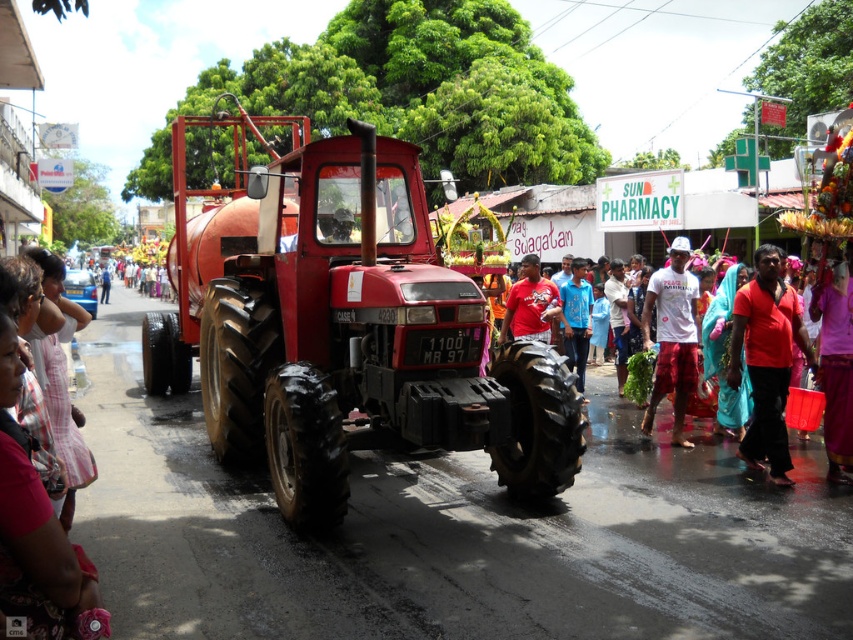
You are standing in the middle of the street during the festival and see two points marked in the scene. The first point is at coordinate point (740, 448) and the second is at point (772, 467). Which point is closer to you?

Point (740, 448) is closer to you because it is further to the viewer than point (772, 467).

You are standing at the point labeled as point (766, 362) in the image. Looking around, you see a large red tractor at the center and a red fabric cloth at center. Which object is directly in front of you?

The point (766, 362) corresponds to the red fabric cloth at center, so the red fabric cloth at center is directly in front of you.